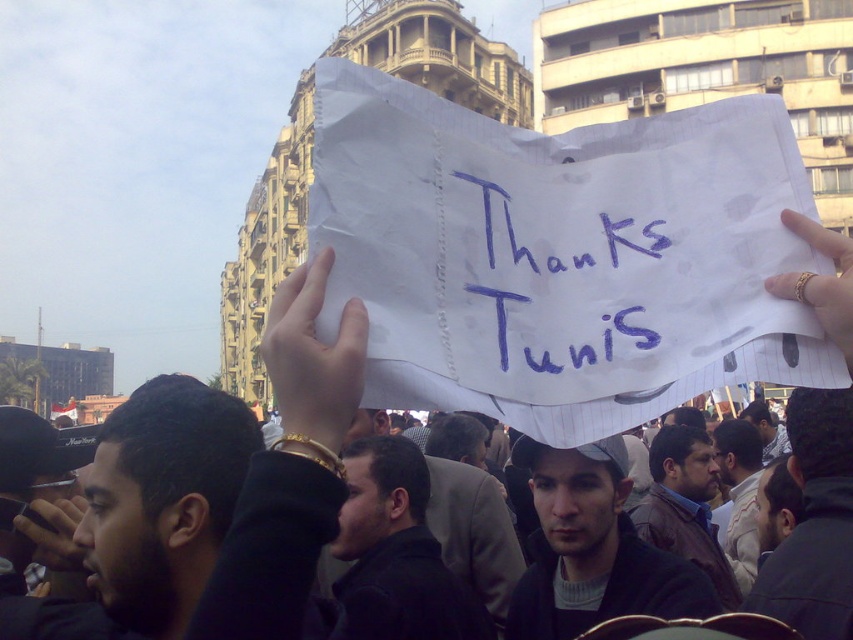
You are a photographer at the event, and you need to capture a photo of the gold ring at upper right and the matte black camera at lower left. Which object is wider?

The gold ring at upper right is wider than the matte black camera at lower left.

You are a photographer standing in the middle of the protest scene. You want to take a closeup shot of the gold ring at upper right. Can you reach it with your camera lens without moving from your current position?

The gold ring at upper right is 39.99 meters away from viewer, so no, you cannot reach it with your camera lens without moving closer.

You are a photographer trying to capture the blue handwritten sign at center in your shot. The camera you are using has a focal length of 50mm. Given that the sign is located at point (550, 272) in the image coordinates, can you estimate the angle of view required to frame the sign properly?

The blue handwritten sign at center is located at point (550, 272) in the image coordinates. To frame it properly with a 50mm focal length, you would need to adjust your camera angle to center the view around those coordinates, ensuring the sign is within the field of view.